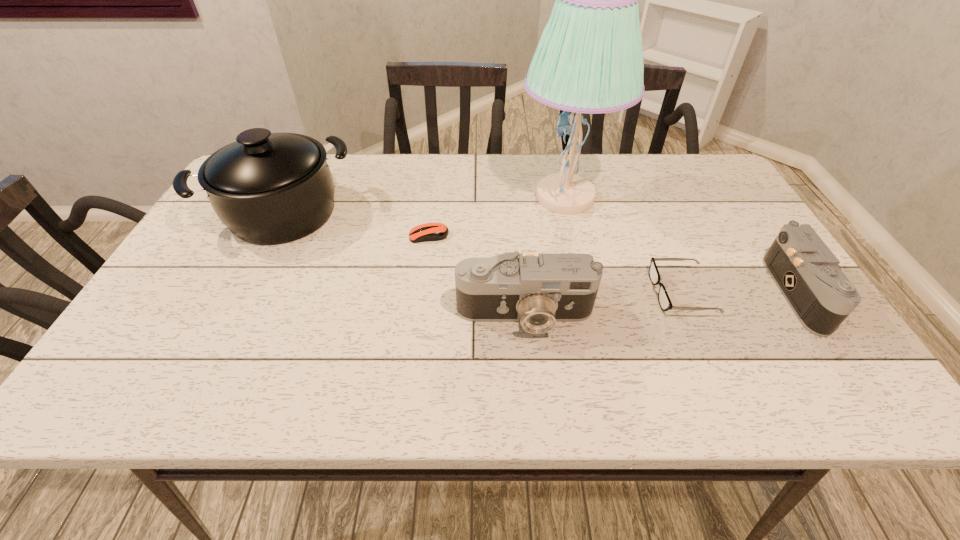
This screenshot has height=540, width=960. Identify the location of spectacles. (665, 303).

Identify the location of blank space located 0.100m on the back of the tallest object. (555, 153).

Where is `free location located on the right of the saucepan`? free location located on the right of the saucepan is located at coordinates (495, 213).

Where is `vacant position located 0.240m on the front of the computer mouse`? This screenshot has height=540, width=960. vacant position located 0.240m on the front of the computer mouse is located at coordinates (420, 316).

This screenshot has width=960, height=540. What are the coordinates of `vacant position located on the front-facing side of the spectacles` in the screenshot? It's located at (614, 292).

Find the location of a particular element. The width and height of the screenshot is (960, 540). free space located on the front-facing side of the spectacles is located at coordinates (558, 292).

The width and height of the screenshot is (960, 540). What are the coordinates of `vacant space situated 0.220m on the front-facing side of the spectacles` in the screenshot? It's located at (558, 292).

Image resolution: width=960 pixels, height=540 pixels. I want to click on lamp positioned at the far edge, so click(589, 59).

Identify the location of saucepan located in the far edge section of the desktop. The width and height of the screenshot is (960, 540). (268, 188).

The height and width of the screenshot is (540, 960). I want to click on object situated at the left edge, so click(x=268, y=188).